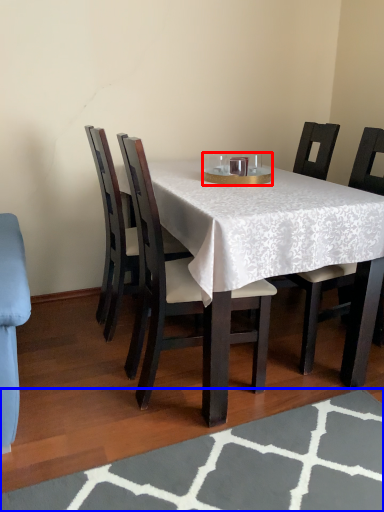
Question: Which of the following is the closest to the observer, tableware (highlighted by a red box) or place mat (highlighted by a blue box)?

Choices:
 (A) tableware
 (B) place mat

Answer: (B)